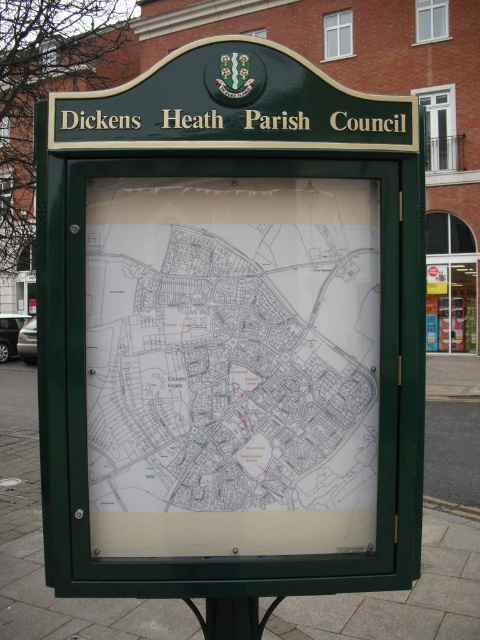
Question: Considering the relative positions of white paper map at center and black plastic pole at lower center in the image provided, where is white paper map at center located with respect to black plastic pole at lower center?

Choices:
 (A) above
 (B) below

Answer: (A)

Question: Does white paper map at center appear on the right side of black plastic pole at lower center?

Choices:
 (A) yes
 (B) no

Answer: (B)

Question: Which object is farther from the camera taking this photo?

Choices:
 (A) black plastic pole at lower center
 (B) white paper map at center

Answer: (A)

Question: Can you confirm if white paper map at center is bigger than black plastic pole at lower center?

Choices:
 (A) yes
 (B) no

Answer: (A)